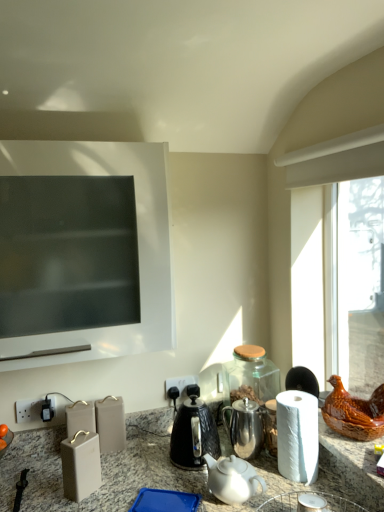
Question: Is shiny metallic teapot at center at the right side of black plastic electric outlet at lower center?

Choices:
 (A) yes
 (B) no

Answer: (A)

Question: Is shiny metallic teapot at center positioned beyond the bounds of black plastic electric outlet at lower center?

Choices:
 (A) no
 (B) yes

Answer: (B)

Question: Is shiny metallic teapot at center far from black plastic electric outlet at lower center?

Choices:
 (A) yes
 (B) no

Answer: (B)

Question: From a real-world perspective, is shiny metallic teapot at center on black plastic electric outlet at lower center?

Choices:
 (A) yes
 (B) no

Answer: (B)

Question: Can you confirm if shiny metallic teapot at center is positioned to the left of black plastic electric outlet at lower center?

Choices:
 (A) yes
 (B) no

Answer: (B)

Question: Considering their positions, is shiny metallic teapot at center located in front of or behind white paper at right?

Choices:
 (A) behind
 (B) front

Answer: (A)

Question: Is shiny metallic teapot at center inside or outside of white paper at right?

Choices:
 (A) outside
 (B) inside

Answer: (A)

Question: From a real-world perspective, is shiny metallic teapot at center physically located above or below white paper at right?

Choices:
 (A) below
 (B) above

Answer: (A)

Question: From the image's perspective, is shiny metallic teapot at center above or below white paper at right?

Choices:
 (A) below
 (B) above

Answer: (A)

Question: Is white ceramic teapot at center inside the boundaries of white paper at right, or outside?

Choices:
 (A) inside
 (B) outside

Answer: (B)

Question: From the image's perspective, is white ceramic teapot at center positioned above or below white paper at right?

Choices:
 (A) below
 (B) above

Answer: (A)

Question: From a real-world perspective, is white ceramic teapot at center above or below white paper at right?

Choices:
 (A) above
 (B) below

Answer: (B)

Question: Looking at their shapes, would you say white ceramic teapot at center is wider or thinner than white paper at right?

Choices:
 (A) wide
 (B) thin

Answer: (A)

Question: In the image, is white paper at right on the left side or the right side of shiny metallic teapot at center?

Choices:
 (A) right
 (B) left

Answer: (A)

Question: Looking at their shapes, would you say white paper at right is wider or thinner than shiny metallic teapot at center?

Choices:
 (A) thin
 (B) wide

Answer: (A)